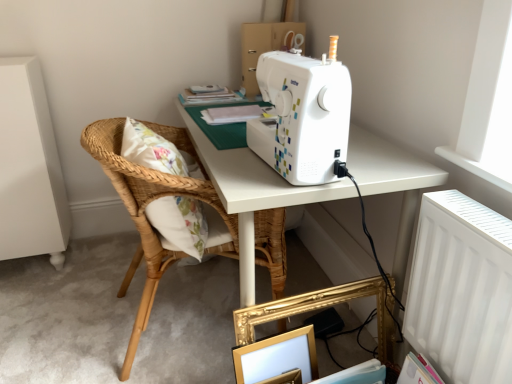
Question: From the image's perspective, is gold metallic picture frame at lower center below white plastic radiator at upper right?

Choices:
 (A) yes
 (B) no

Answer: (A)

Question: Can you confirm if gold metallic picture frame at lower center is smaller than white plastic radiator at upper right?

Choices:
 (A) no
 (B) yes

Answer: (B)

Question: Does gold metallic picture frame at lower center have a lesser width compared to white plastic radiator at upper right?

Choices:
 (A) yes
 (B) no

Answer: (B)

Question: Considering the relative sizes of gold metallic picture frame at lower center and white plastic radiator at upper right in the image provided, is gold metallic picture frame at lower center shorter than white plastic radiator at upper right?

Choices:
 (A) no
 (B) yes

Answer: (B)

Question: Is gold metallic picture frame at lower center positioned in front of white plastic radiator at upper right?

Choices:
 (A) yes
 (B) no

Answer: (B)

Question: Considering the positions of white plastic sewing machine at upper center and natural woven wood pillow at left in the image, is white plastic sewing machine at upper center taller or shorter than natural woven wood pillow at left?

Choices:
 (A) short
 (B) tall

Answer: (B)

Question: Is point (216, 170) positioned closer to the camera than point (179, 173)?

Choices:
 (A) closer
 (B) farther

Answer: (A)

Question: Considering the relative positions of white plastic sewing machine at upper center and natural woven wood pillow at left in the image provided, is white plastic sewing machine at upper center to the left or to the right of natural woven wood pillow at left?

Choices:
 (A) left
 (B) right

Answer: (B)

Question: From a real-world perspective, is white plastic sewing machine at upper center above or below natural woven wood pillow at left?

Choices:
 (A) above
 (B) below

Answer: (B)

Question: Considering their positions, is white plastic sewing machine at upper center located in front of or behind woven wood chair at left?

Choices:
 (A) behind
 (B) front

Answer: (B)

Question: From the image's perspective, is white plastic sewing machine at upper center positioned above or below woven wood chair at left?

Choices:
 (A) above
 (B) below

Answer: (A)

Question: In terms of height, does white plastic sewing machine at upper center look taller or shorter compared to woven wood chair at left?

Choices:
 (A) tall
 (B) short

Answer: (B)

Question: Is point (288, 107) positioned closer to the camera than point (153, 243)?

Choices:
 (A) closer
 (B) farther

Answer: (A)

Question: From a real-world perspective, is white paper at upper center physically located above or below matte cardboard box at upper center?

Choices:
 (A) above
 (B) below

Answer: (B)

Question: From the image's perspective, is white paper at upper center positioned above or below matte cardboard box at upper center?

Choices:
 (A) above
 (B) below

Answer: (B)